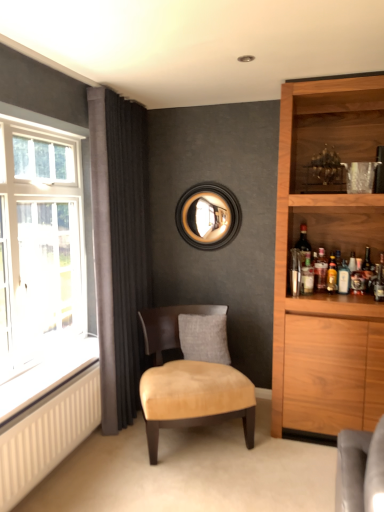
Question: From the image's perspective, is black wood mirror at upper center above shiny dark glass bottle at right, the 1th bottle positioned from the right?

Choices:
 (A) yes
 (B) no

Answer: (A)

Question: Is shiny dark glass bottle at right, arranged as the 3th bottle when viewed from the left, at the back of black wood mirror at upper center?

Choices:
 (A) yes
 (B) no

Answer: (B)

Question: From a real-world perspective, is black wood mirror at upper center located higher than shiny dark glass bottle at right, the 1th bottle positioned from the right?

Choices:
 (A) yes
 (B) no

Answer: (A)

Question: Is there a large distance between black wood mirror at upper center and shiny dark glass bottle at right, the 1th bottle positioned from the right?

Choices:
 (A) no
 (B) yes

Answer: (B)

Question: Could you tell me if black wood mirror at upper center is facing shiny dark glass bottle at right, arranged as the 3th bottle when viewed from the left?

Choices:
 (A) yes
 (B) no

Answer: (B)

Question: Considering the relative sizes of black wood mirror at upper center and shiny dark glass bottle at right, arranged as the 3th bottle when viewed from the left, in the image provided, is black wood mirror at upper center shorter than shiny dark glass bottle at right, arranged as the 3th bottle when viewed from the left,?

Choices:
 (A) yes
 (B) no

Answer: (B)

Question: Does clear glass window at left have a lesser height compared to matte dark brown wine bottle at right?

Choices:
 (A) yes
 (B) no

Answer: (B)

Question: From a real-world perspective, is clear glass window at left physically below matte dark brown wine bottle at right?

Choices:
 (A) yes
 (B) no

Answer: (B)

Question: Is clear glass window at left to the left of matte dark brown wine bottle at right from the viewer's perspective?

Choices:
 (A) yes
 (B) no

Answer: (A)

Question: Is clear glass window at left beside matte dark brown wine bottle at right?

Choices:
 (A) no
 (B) yes

Answer: (A)

Question: Can you confirm if clear glass window at left is bigger than matte dark brown wine bottle at right?

Choices:
 (A) no
 (B) yes

Answer: (B)

Question: Is the position of clear glass window at left more distant than that of matte dark brown wine bottle at right?

Choices:
 (A) no
 (B) yes

Answer: (A)

Question: From a real-world perspective, does suede-like beige chair at center stand above matte dark brown wine bottle at right?

Choices:
 (A) yes
 (B) no

Answer: (B)